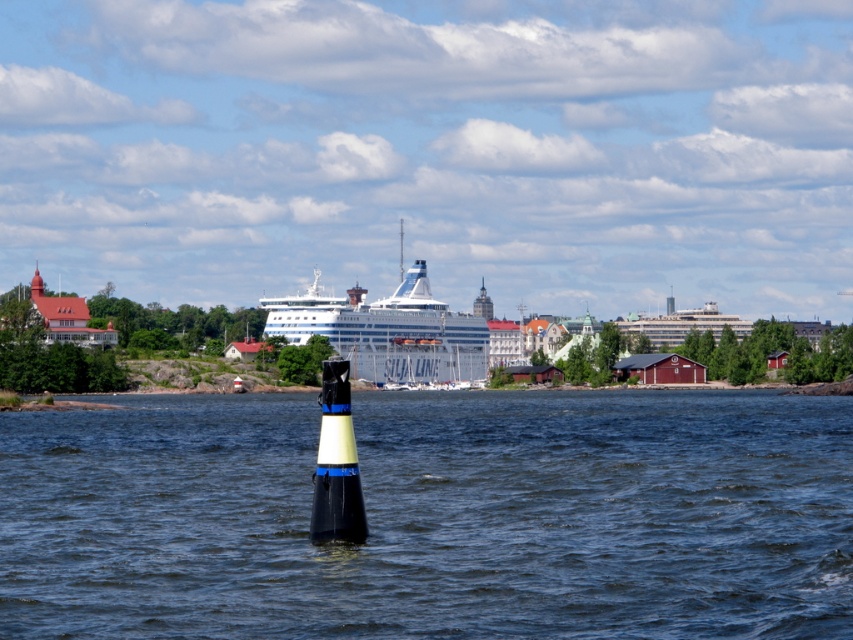
Which is more to the left, black rubber buoy at center or white glossy cruise ship at center?

Positioned to the left is white glossy cruise ship at center.

Is black rubber buoy at center below white glossy cruise ship at center?

Indeed, black rubber buoy at center is positioned under white glossy cruise ship at center.

Is point (456, 497) positioned in front of point (444, 314)?

Yes, it is in front of point (444, 314).

Where is `black rubber buoy at center`? The image size is (853, 640). black rubber buoy at center is located at coordinates (433, 516).